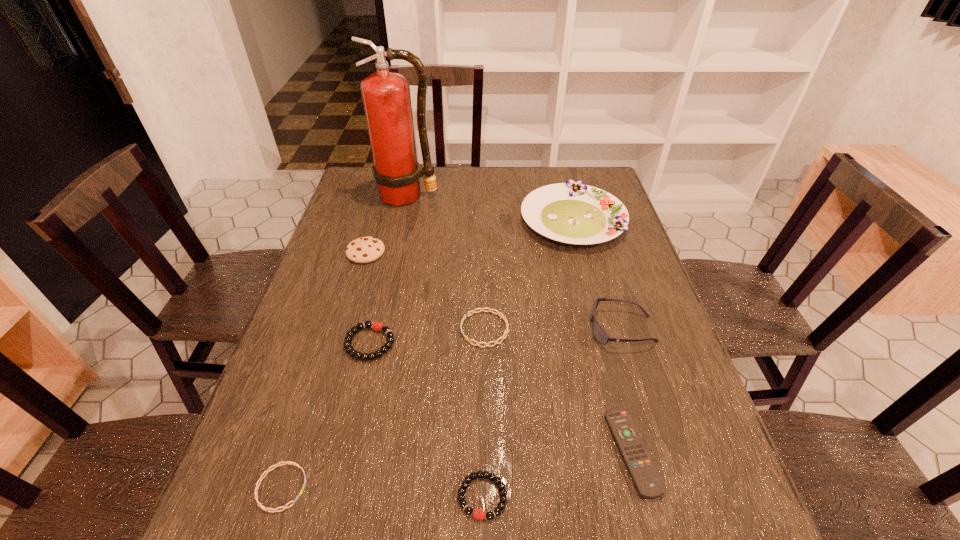
Find the location of `the tallest object`. the tallest object is located at coordinates (386, 96).

Find the location of a particular element. fire extinguisher is located at coordinates (386, 96).

The image size is (960, 540). Find the location of `salad plate`. salad plate is located at coordinates (572, 212).

This screenshot has height=540, width=960. I want to click on sunglasses, so click(x=600, y=335).

Locate an element on the screen. brown cookie is located at coordinates (365, 249).

Locate an element on the screen. the fourth tallest object is located at coordinates (365, 249).

Locate an element on the screen. the bigger black bracelet is located at coordinates (377, 326).

You are a GUI agent. You are given a task and a screenshot of the screen. Output one action in this format:
    pyautogui.click(x=<x>, y=<y>)
    Task: Click on the farther black bracelet
    The width and height of the screenshot is (960, 540).
    Given the screenshot: What is the action you would take?
    pyautogui.click(x=377, y=326)

I want to click on the right blue bracelet, so click(481, 309).

Identify the location of the farther blue bracelet. (481, 309).